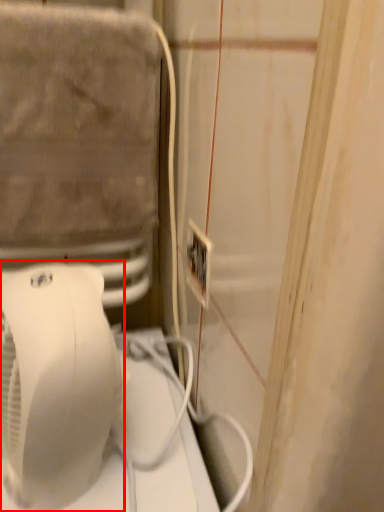
Question: From the image, what is the correct spatial relationship of home appliance (annotated by the red box) in relation to electric outlet?

Choices:
 (A) right
 (B) left

Answer: (B)